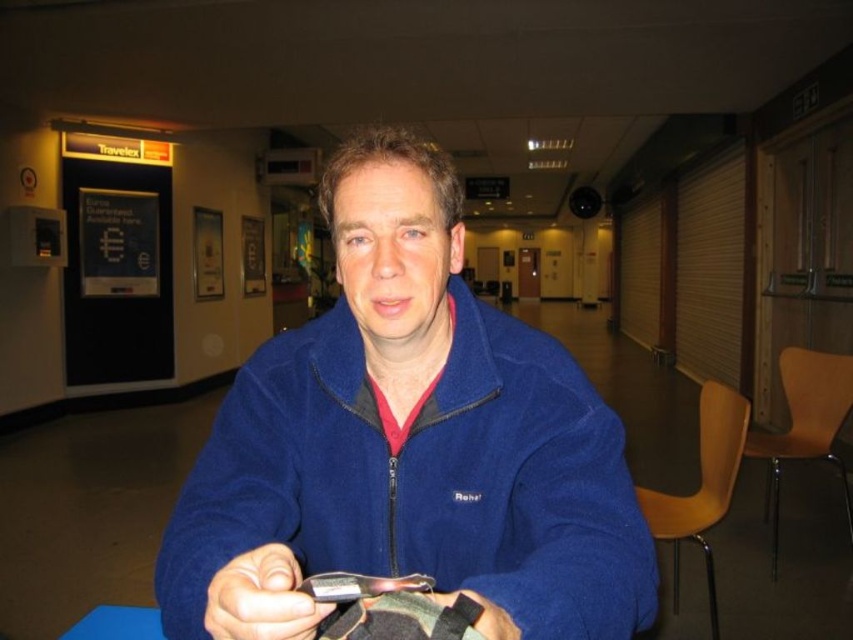
Who is lower down, blue fleece jacket at center or matte black phone at lower center?

Positioned lower is matte black phone at lower center.

I want to click on blue fleece jacket at center, so click(x=407, y=442).

Where is `blue fleece jacket at center`? blue fleece jacket at center is located at coordinates (407, 442).

Which is more to the left, matte black phone at lower center or blue matte table at lower left?

blue matte table at lower left is more to the left.

From the picture: Which of these two, matte black phone at lower center or blue matte table at lower left, stands shorter?

Standing shorter between the two is matte black phone at lower center.

I want to click on matte black phone at lower center, so click(x=260, y=598).

Locate an element on the screen. The height and width of the screenshot is (640, 853). matte black phone at lower center is located at coordinates (260, 598).

Does blue fleece jacket at center have a lesser height compared to black matte wristband at center?

Incorrect, blue fleece jacket at center's height does not fall short of black matte wristband at center's.

Between point (405, 266) and point (447, 596), which one is positioned in front?

Point (447, 596) is more forward.

Find the location of a particular element. Image resolution: width=853 pixels, height=640 pixels. blue fleece jacket at center is located at coordinates (407, 442).